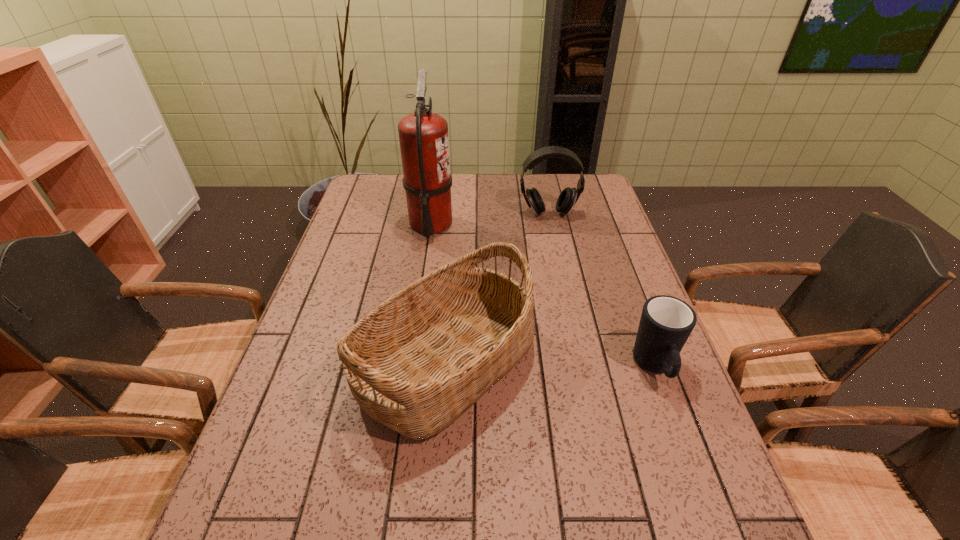
This screenshot has height=540, width=960. Find the location of `the tallest object`. the tallest object is located at coordinates (423, 136).

Find the location of a particular element. The height and width of the screenshot is (540, 960). earphone is located at coordinates (568, 197).

Where is `basket`? Image resolution: width=960 pixels, height=540 pixels. basket is located at coordinates (419, 360).

The width and height of the screenshot is (960, 540). I want to click on mug, so click(x=666, y=322).

Locate an element on the screen. the rightmost object is located at coordinates (666, 322).

Locate an element on the screen. blank space located 0.360m toward the nozzle of the fire extinguisher is located at coordinates (562, 224).

Where is `free space located on the ear cups of the earphone`? Image resolution: width=960 pixels, height=540 pixels. free space located on the ear cups of the earphone is located at coordinates (562, 276).

Locate an element on the screen. free space located 0.150m on the left of the basket is located at coordinates (296, 362).

I want to click on vacant space located 0.150m on the side of the mug with the handle, so [x=690, y=464].

This screenshot has height=540, width=960. In order to click on object that is at the far edge in this screenshot , I will do `click(423, 136)`.